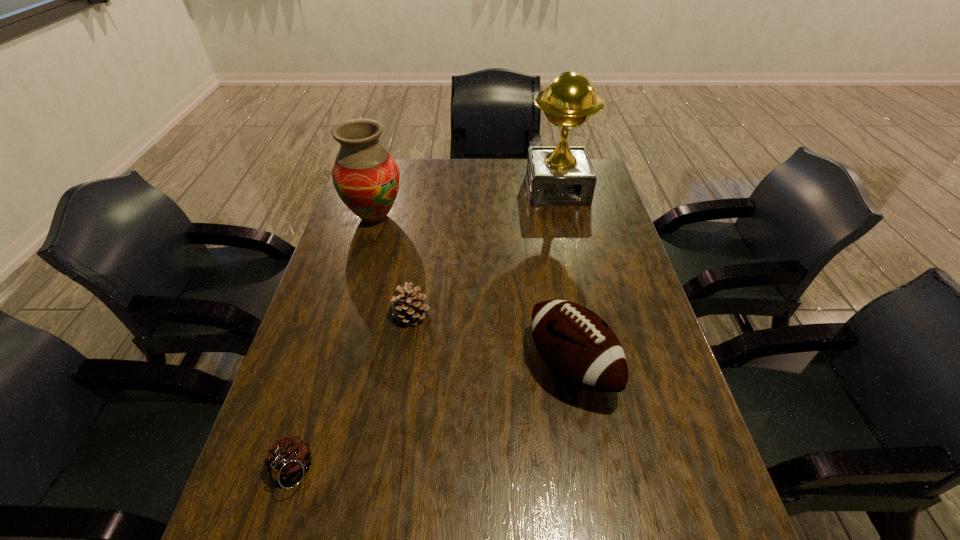
I want to click on free spot between the fourth shortest object and the award, so click(x=466, y=203).

What are the coordinates of `vacant area between the left pinecone and the fourth shortest object` in the screenshot? It's located at (333, 344).

The width and height of the screenshot is (960, 540). Identify the location of object that is the closest one to the nearer pinecone. (410, 309).

Identify which object is located as the fourth nearest to the award. Please provide its 2D coordinates. Your answer should be formatted as a tuple, i.e. [(x, y)], where the tuple contains the x and y coordinates of a point satisfying the conditions above.

[(288, 458)]

Image resolution: width=960 pixels, height=540 pixels. I want to click on free location that satisfies the following two spatial constraints: 1. on the front side of the vase; 2. on the left side of the third tallest object, so click(x=331, y=366).